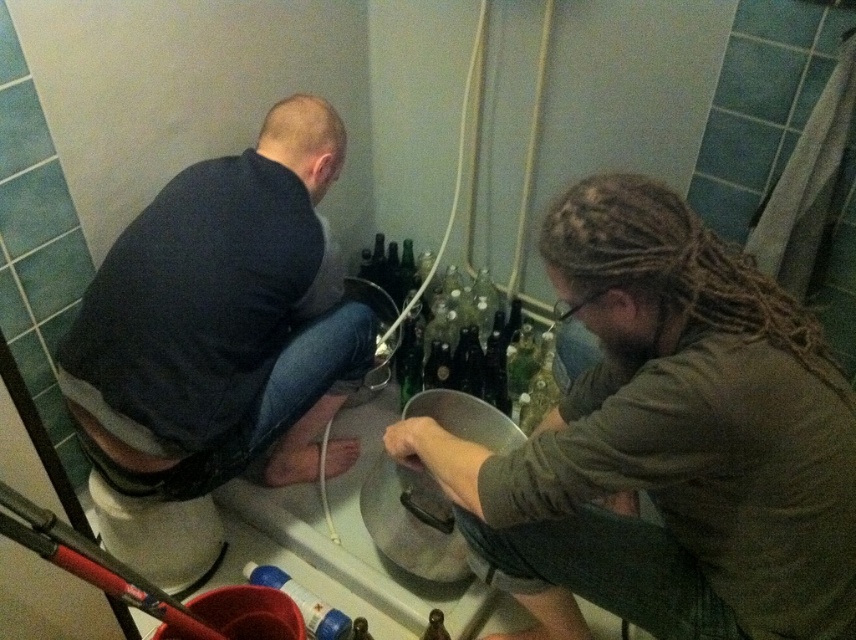
Question: Is dark gray shirt at left closer to camera compared to blue plastic bottle at lower center?

Choices:
 (A) yes
 (B) no

Answer: (A)

Question: In this image, where is dark gray shirt at left located relative to blue plastic bottle at lower center?

Choices:
 (A) left
 (B) right

Answer: (A)

Question: Which point appears farthest from the camera in this image?

Choices:
 (A) (85, 365)
 (B) (316, 628)

Answer: (B)

Question: Does dark gray shirt at left have a lesser width compared to blue plastic bottle at lower center?

Choices:
 (A) no
 (B) yes

Answer: (A)

Question: Which object appears farthest from the camera in this image?

Choices:
 (A) dark gray shirt at left
 (B) blue plastic bottle at lower center

Answer: (B)

Question: Among these points, which one is nearest to the camera?

Choices:
 (A) (304, 589)
 (B) (269, 129)

Answer: (B)